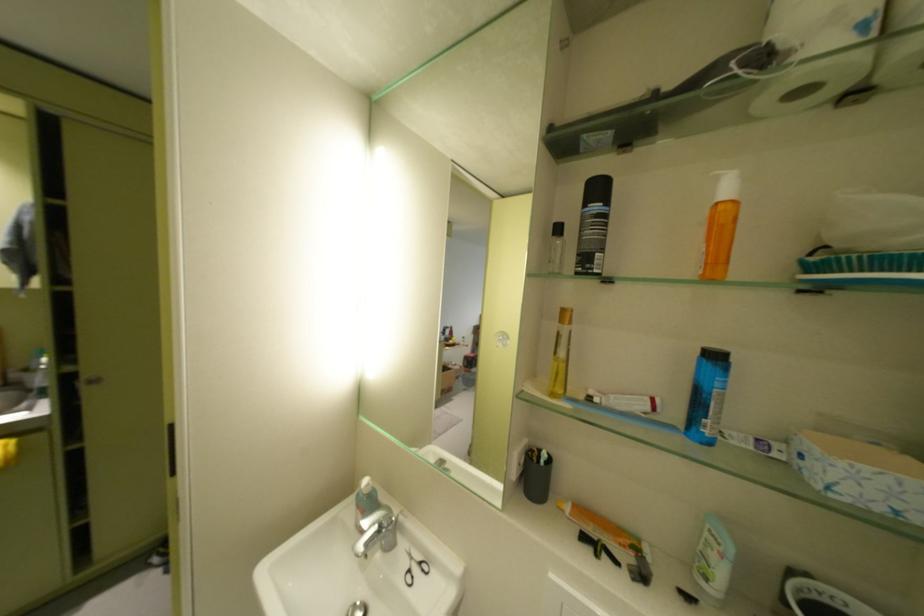
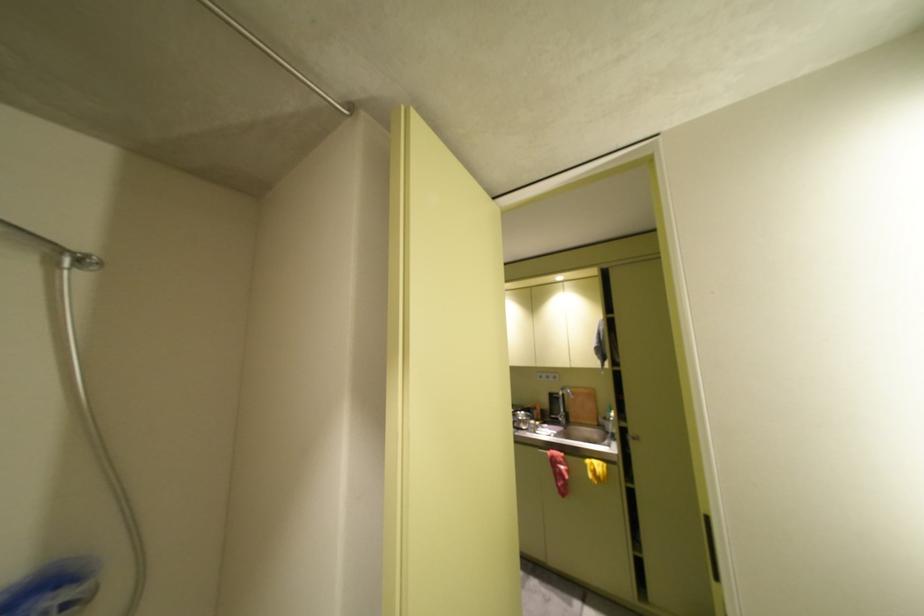
Question: Based on the continuous images, in which direction is the camera rotating? Reply with the corresponding letter.

Choices:
 (A) Left
 (B) Right
 (C) Up
 (D) Down

Answer: (A)